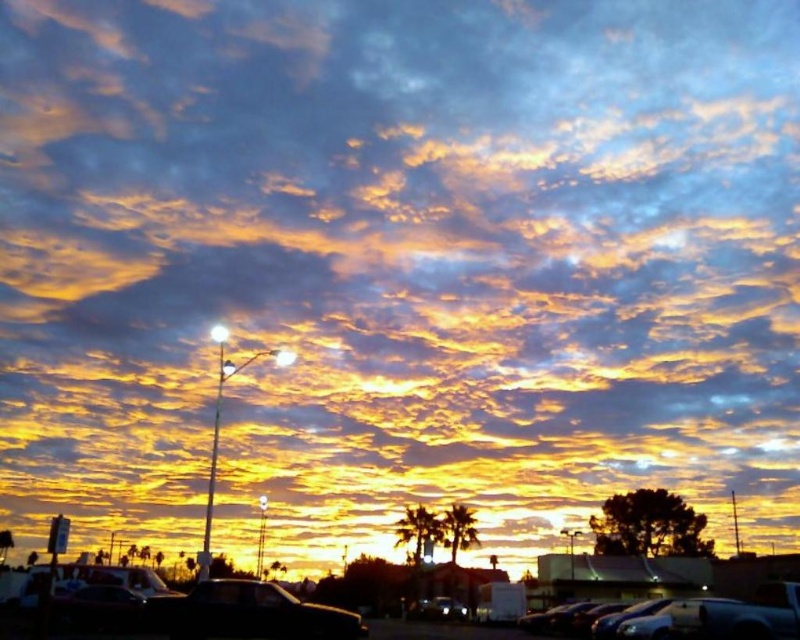
You are standing at the center of the parking lot and see the black glossy car at lower center. Based on its position, can you determine if it is parked closer to the streetlamp or further away from it?

The black glossy car at lower center is located at point (249,612), which indicates its position relative to the streetlamp. Since the coordinates place it closer to the lower part of the image, it is likely parked closer to the streetlamp.

You are standing on the sidewalk and see the black glossy car at lower center and the black asphalt parking lot at lower center. Which object is nearer to you?

The black glossy car at lower center is closer to the viewer than the black asphalt parking lot at lower center, so the car is nearer.